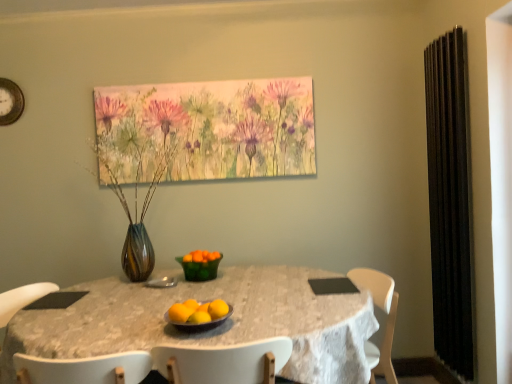
You are a GUI agent. You are given a task and a screenshot of the screen. Output one action in this format:
    pyautogui.click(x=<x>, y=<y>)
    Task: Click on the free spot to the right of green glass bowl at center
    This screenshot has width=512, height=384.
    Given the screenshot: What is the action you would take?
    pyautogui.click(x=244, y=274)